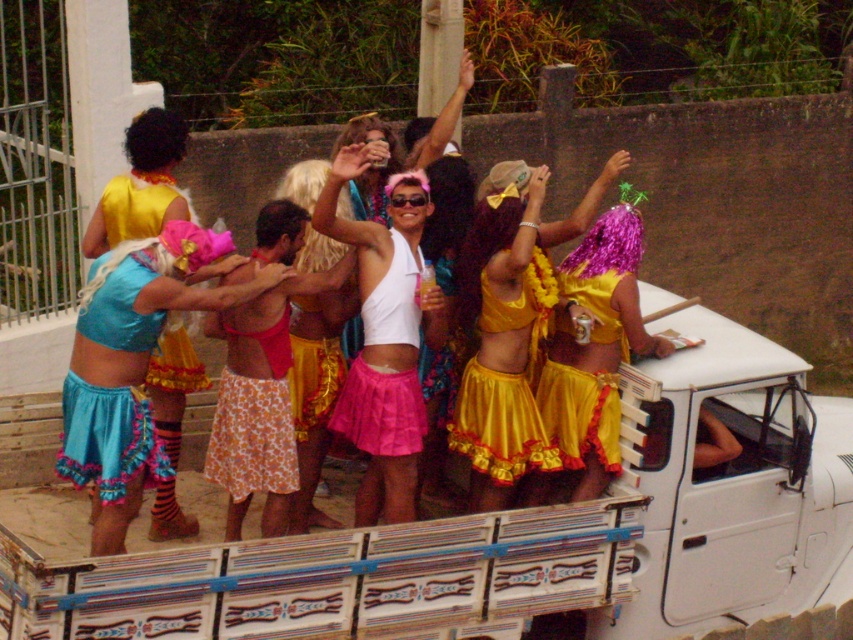
What is the position of the blue satin skirt at center in the image?

The blue satin skirt at center is located at point [134,364].

You are a photographer trying to capture the best shot of the blue satin skirt at center and the yellow satin dress at center. Which one is positioned lower in the image?

The blue satin skirt at center is positioned lower than the yellow satin dress at center.

You are a photographer trying to capture the group in the pickup truck bed. You notice two yellow satin garments at the center of the scene. Which one is more to the left, the yellow satin skirt at center or the yellow satin dress at center?

The yellow satin skirt at center is more to the left than the yellow satin dress at center.